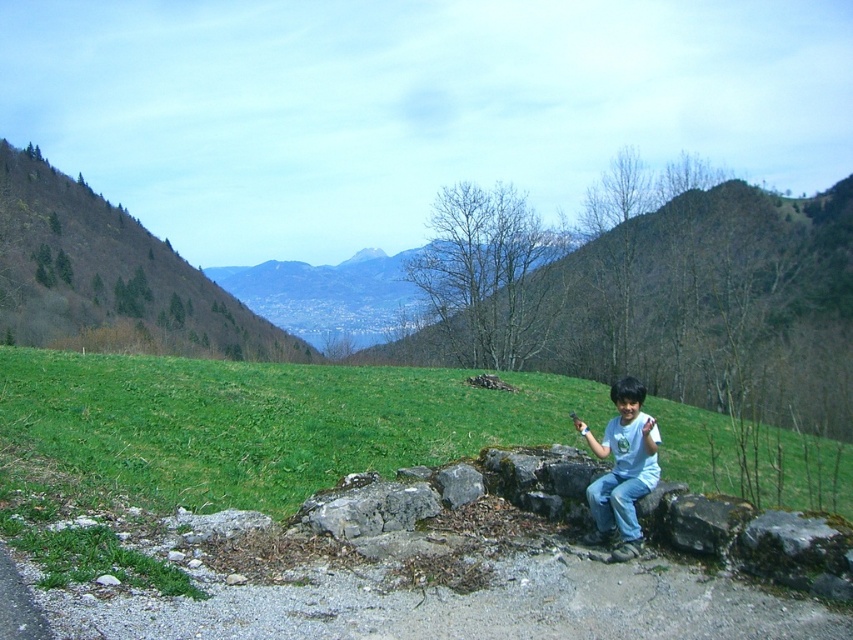
Question: Which point is farther from the camera taking this photo?

Choices:
 (A) (651, 433)
 (B) (189, 330)
 (C) (596, 522)
 (D) (177, 465)

Answer: (B)

Question: Can you confirm if green grassy hillside at center is thinner than light blue cotton shirt at center?

Choices:
 (A) no
 (B) yes

Answer: (A)

Question: Which point appears closest to the camera in this image?

Choices:
 (A) (633, 449)
 (B) (88, 317)
 (C) (602, 508)

Answer: (A)

Question: Does green leafy hillside at upper left have a lesser width compared to blue denim jeans at lower center?

Choices:
 (A) yes
 (B) no

Answer: (B)

Question: Estimate the real-world distances between objects in this image. Which object is farther from the light blue cotton shirt at center?

Choices:
 (A) green leafy hillside at upper left
 (B) blue denim jeans at lower center
 (C) green grassy hillside at center

Answer: (A)

Question: Where is green leafy hillside at upper left located in relation to blue denim jeans at lower center in the image?

Choices:
 (A) above
 (B) below

Answer: (A)